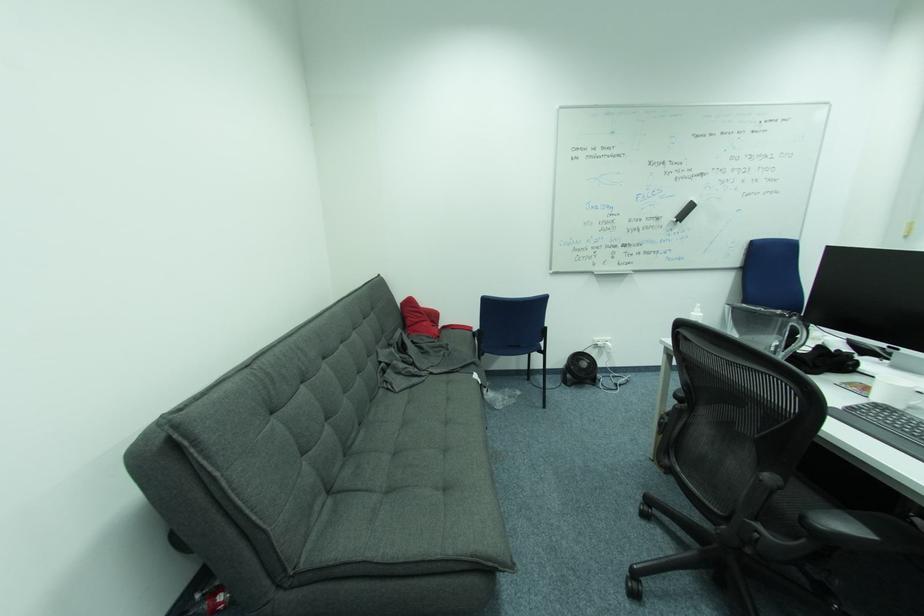
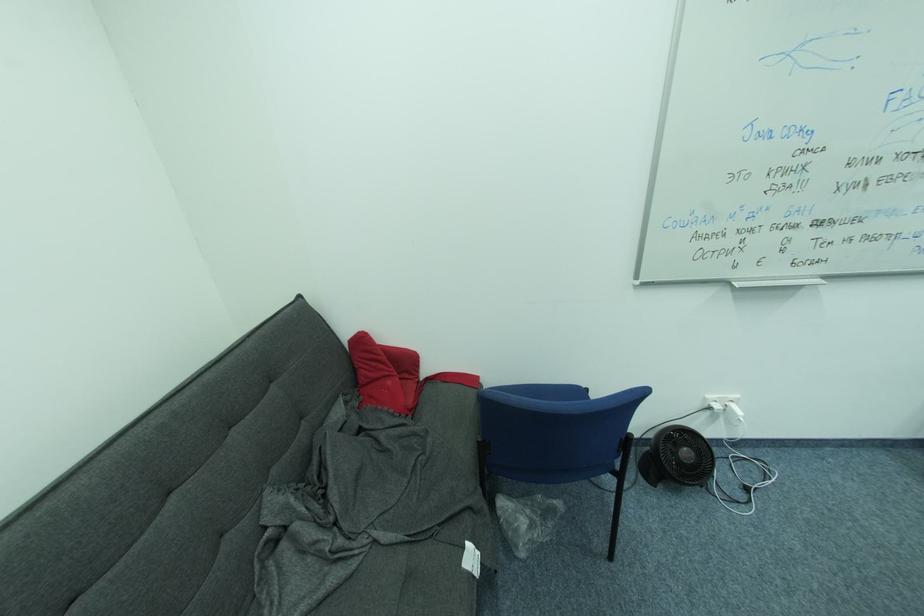
Locate, in the second image, the point that corresponds to the point at 407,301 in the first image.

(353, 336)